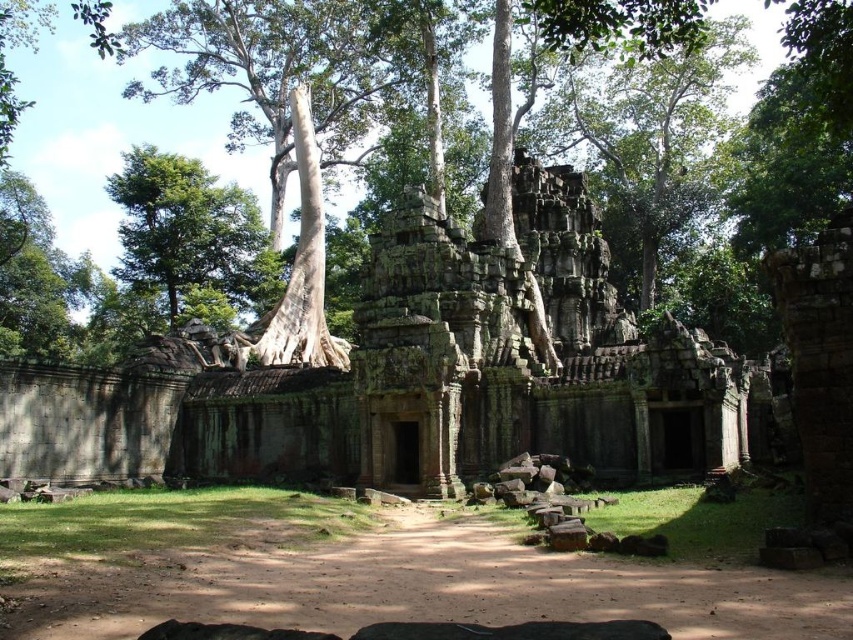
Question: Which point is farther to the camera?

Choices:
 (A) (112, 180)
 (B) (631, 90)

Answer: (B)

Question: Can you confirm if green textured tree at center is bigger than green leafy tree at upper left?

Choices:
 (A) yes
 (B) no

Answer: (A)

Question: Is green textured tree at center to the left of green leafy tree at upper left from the viewer's perspective?

Choices:
 (A) yes
 (B) no

Answer: (B)

Question: Which of the following is the farthest from the observer?

Choices:
 (A) green textured tree at center
 (B) green leafy tree at upper left

Answer: (B)

Question: Is green textured tree at center smaller than green leafy tree at upper left?

Choices:
 (A) no
 (B) yes

Answer: (A)

Question: Which point is closer to the camera?

Choices:
 (A) green textured tree at center
 (B) green leafy tree at upper left

Answer: (A)